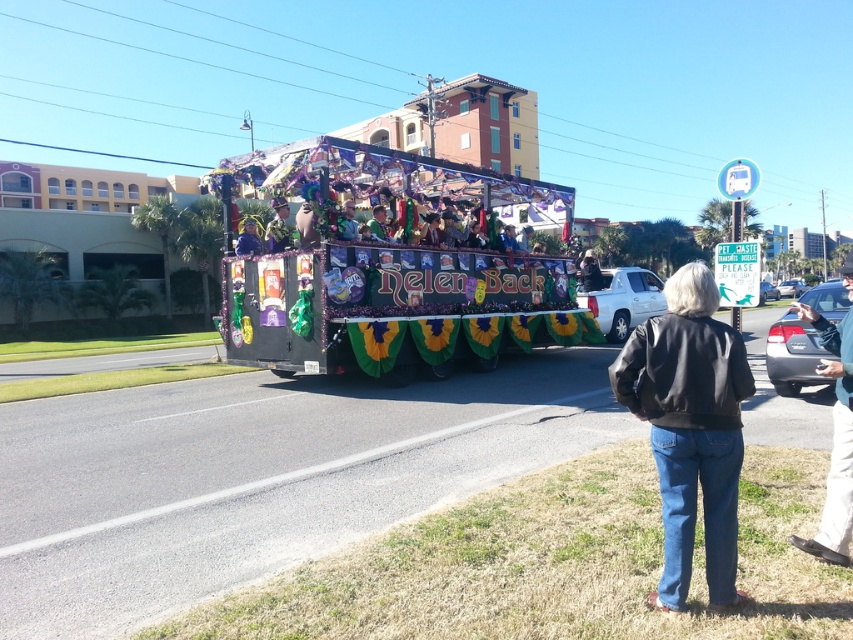
Who is taller, black leather jacket at lower right or blue fabric at center?

black leather jacket at lower right

You are a GUI agent. You are given a task and a screenshot of the screen. Output one action in this format:
    pyautogui.click(x=<x>, y=<y>)
    Task: Click on the black leather jacket at lower right
    
    Given the screenshot: What is the action you would take?
    pyautogui.click(x=689, y=429)

Locate an element on the screen. The image size is (853, 640). black leather jacket at lower right is located at coordinates (689, 429).

Identify the location of black leather jacket at lower right. (689, 429).

Which is behind, point (834, 342) or point (248, 248)?

Positioned behind is point (248, 248).

Can you confirm if khaki pants at lower right is thinner than blue fabric at center?

No, khaki pants at lower right is not thinner than blue fabric at center.

Image resolution: width=853 pixels, height=640 pixels. Describe the element at coordinates (834, 440) in the screenshot. I see `khaki pants at lower right` at that location.

The width and height of the screenshot is (853, 640). Identify the location of khaki pants at lower right. (834, 440).

Does black leather jacket at lower right have a lesser width compared to khaki pants at lower right?

Indeed, black leather jacket at lower right has a lesser width compared to khaki pants at lower right.

Between point (700, 368) and point (846, 280), which one is positioned behind?

The point (846, 280) is more distant.

Which is in front, point (682, 580) or point (816, 328)?

Point (682, 580) is in front.

Identify the location of black leather jacket at lower right. The image size is (853, 640). (689, 429).